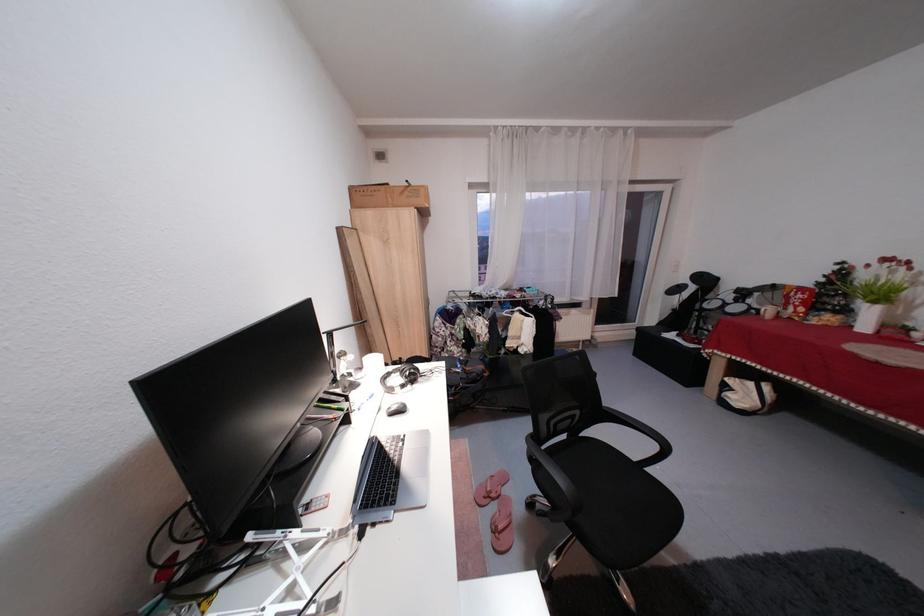
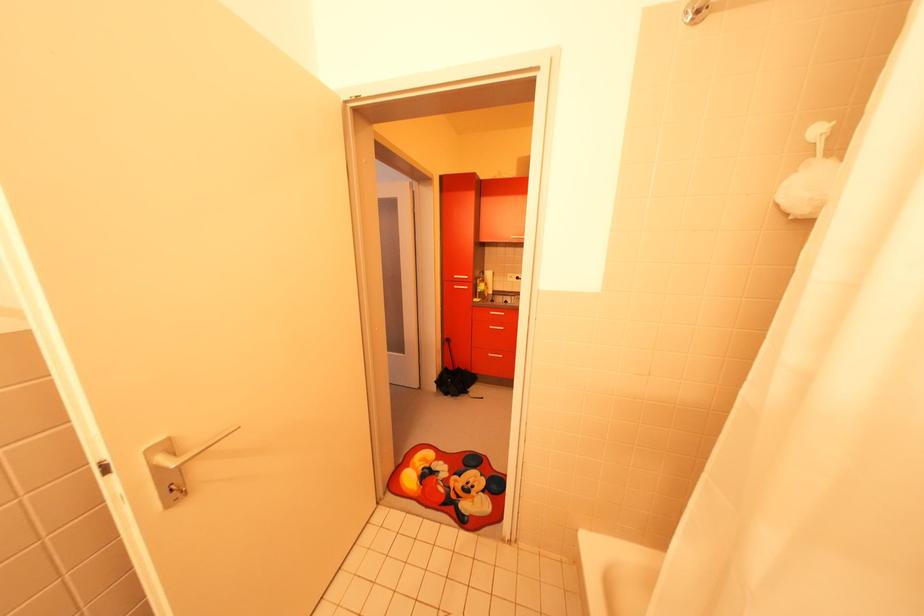
Question: I am providing you with two images of the same scene from different viewpoints. After the viewpoint changes to image2, which objects are now occluded?

Choices:
 (A) silver door handle
 (B) chrome shower head
 (C) red ceramic mug
 (D) metal clamp

Answer: (C)